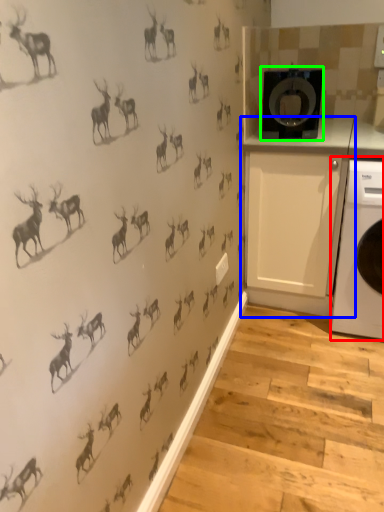
Question: Which is nearer to the home appliance (highlighted by a red box)? cabinetry (highlighted by a blue box) or washing machine (highlighted by a green box).

Choices:
 (A) cabinetry
 (B) washing machine

Answer: (A)